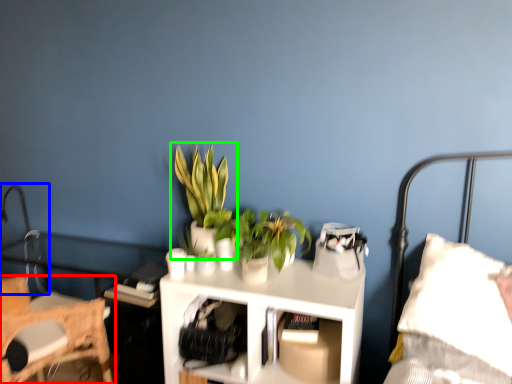
Question: Which object is positioned farthest from chair (highlighted by a red box)? Select from table lamp (highlighted by a blue box) and houseplant (highlighted by a green box).

Choices:
 (A) table lamp
 (B) houseplant

Answer: (A)